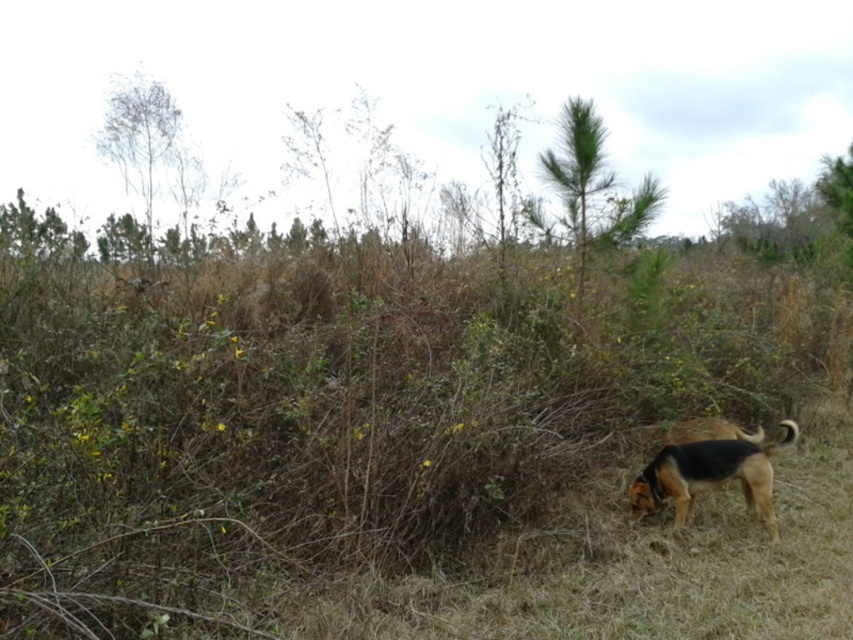
You are standing in the meadow and want to take a photo of the brown fur dog at lower right without the bare branches at upper left blocking the view. Which direction should you move to ensure the branches are no longer in the frame?

Move to the right or left so that the bare branches at upper left are no longer positioned over the brown fur dog at lower right, thus removing them from the frame.

You are a bird planning to land on the bare branches at upper left. What are the coordinates where you should aim to land?

The coordinates to aim for are at point (144, 144).

You are standing in a meadow and see two points marked in the scene. The first point is at coordinate (103, 138) and the second is at (653, 512). Which point is closer to you?

Point (103, 138) is closer to you because it is further to the viewer than point (653, 512).